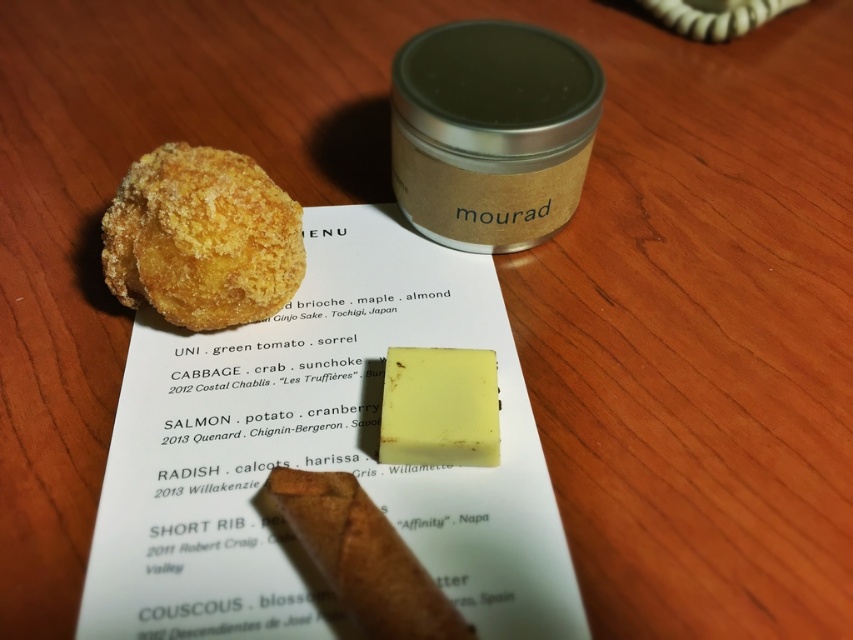
Question: Does golden crispy croquette at upper left appear on the left side of yellow wax cheese at center?

Choices:
 (A) yes
 (B) no

Answer: (A)

Question: Which object appears closest to the camera in this image?

Choices:
 (A) yellow wax cheese at center
 (B) golden crispy croquette at upper left

Answer: (A)

Question: Is golden crispy croquette at upper left thinner than yellow wax cheese at center?

Choices:
 (A) no
 (B) yes

Answer: (A)

Question: Which point is closer to the camera?

Choices:
 (A) golden crispy croquette at upper left
 (B) yellow wax cheese at center

Answer: (B)

Question: Which object is closer to the camera taking this photo?

Choices:
 (A) golden crispy croquette at upper left
 (B) yellow wax cheese at center

Answer: (B)

Question: Does golden crispy croquette at upper left appear on the left side of yellow wax cheese at center?

Choices:
 (A) no
 (B) yes

Answer: (B)